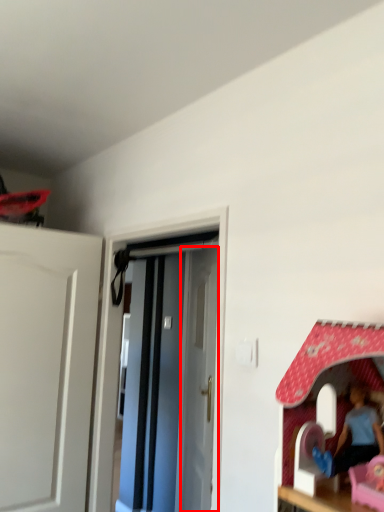
Question: Where is door (annotated by the red box) located in relation to door in the image?

Choices:
 (A) right
 (B) left

Answer: (A)